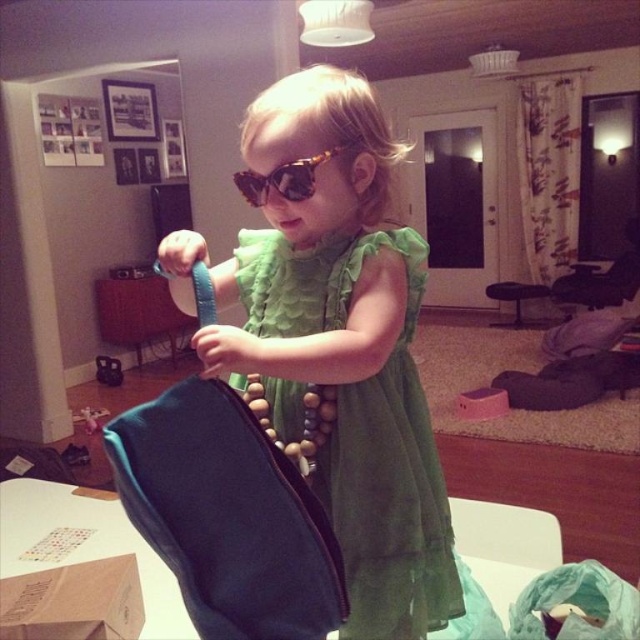
Question: Is green chiffon dress at center in front of teal fabric bag at center?

Choices:
 (A) yes
 (B) no

Answer: (B)

Question: Is matte black phone at lower left to the right of metallic silver toy at center from the viewer's perspective?

Choices:
 (A) no
 (B) yes

Answer: (A)

Question: Which point appears closest to the camera in this image?

Choices:
 (A) (84, 426)
 (B) (278, 168)
 (C) (499, 390)
 (D) (371, 593)

Answer: (B)

Question: Does teal fabric bag at center appear under pink fabric toy at center?

Choices:
 (A) yes
 (B) no

Answer: (B)

Question: Among these objects, which one is nearest to the camera?

Choices:
 (A) tortoiseshell acetate sunglasses at center
 (B) teal fabric bag at center
 (C) pink fabric toy at center
 (D) matte black phone at lower left

Answer: (B)

Question: Which of the following is the farthest from the observer?

Choices:
 (A) (349, 467)
 (B) (116, 368)
 (C) (248, 193)

Answer: (B)